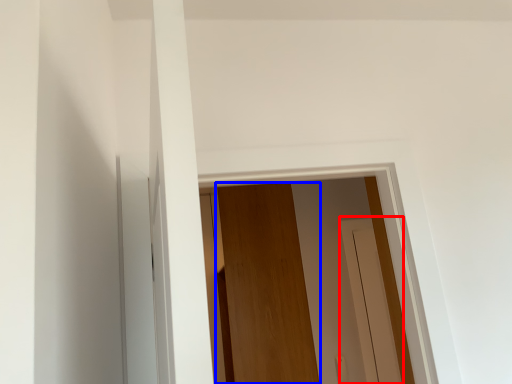
Question: Which of the following is the closest to the observer, screen door (highlighted by a red box) or door (highlighted by a blue box)?

Choices:
 (A) screen door
 (B) door

Answer: (B)